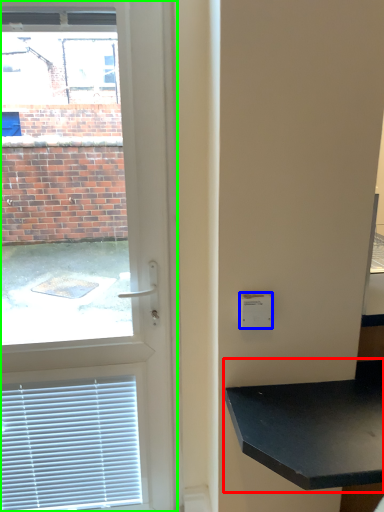
Question: Based on their relative distances, which object is farther from table (highlighted by a red box)? Choose from light switch (highlighted by a blue box) and door (highlighted by a green box).

Choices:
 (A) light switch
 (B) door

Answer: (B)